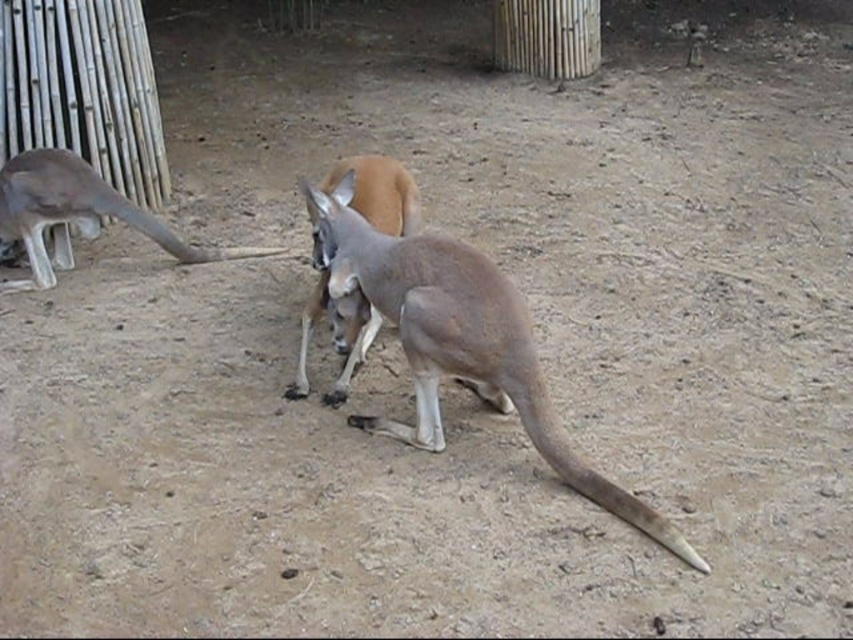
Consider the image. You are a zookeeper observing two gray fur kangaroos in the enclosure. You need to approach the gray fur kangaroo at center and the gray fur kangaroo at left. Which kangaroo should you approach first to minimize walking distance?

You should approach the gray fur kangaroo at center first because it is closer to you than the gray fur kangaroo at left.

You are standing at the point marked by the coordinate point at (407,333). You want to walk towards the kangaroo facing away from you on the right side of the frame. How far will you have to walk to reach the kangaroo?

The distance between you and the kangaroo facing away from you on the right side of the frame is 8.81 feet, so you will have to walk 8.81 feet to reach the kangaroo.

You are observing two gray fur kangaroos in the zoo enclosure. The gray fur kangaroo at center and the gray fur kangaroo at left. Which one is positioned lower in the image?

The gray fur kangaroo at center is positioned lower in the image than the gray fur kangaroo at left.